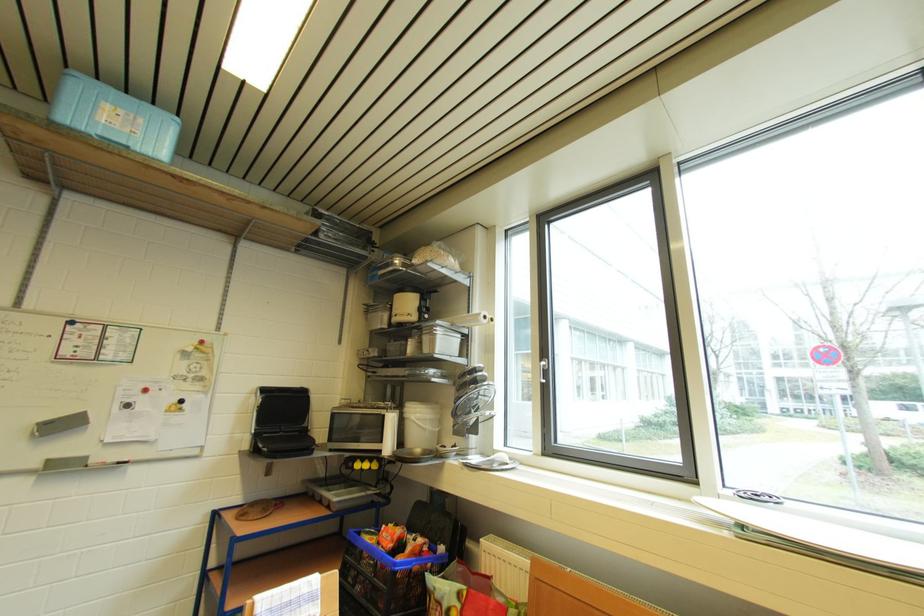
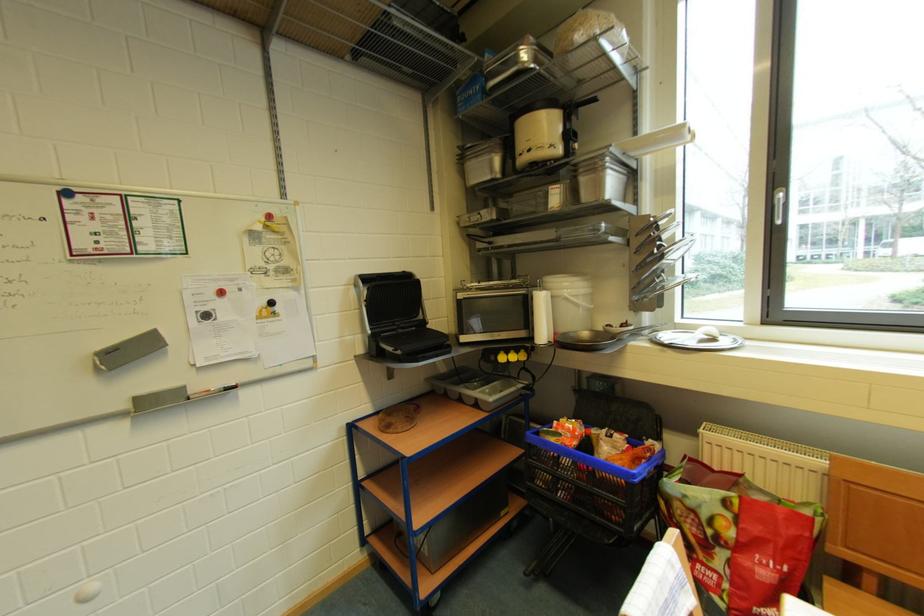
Find the pixel in the second image that matches [423,422] in the first image.

(578, 299)